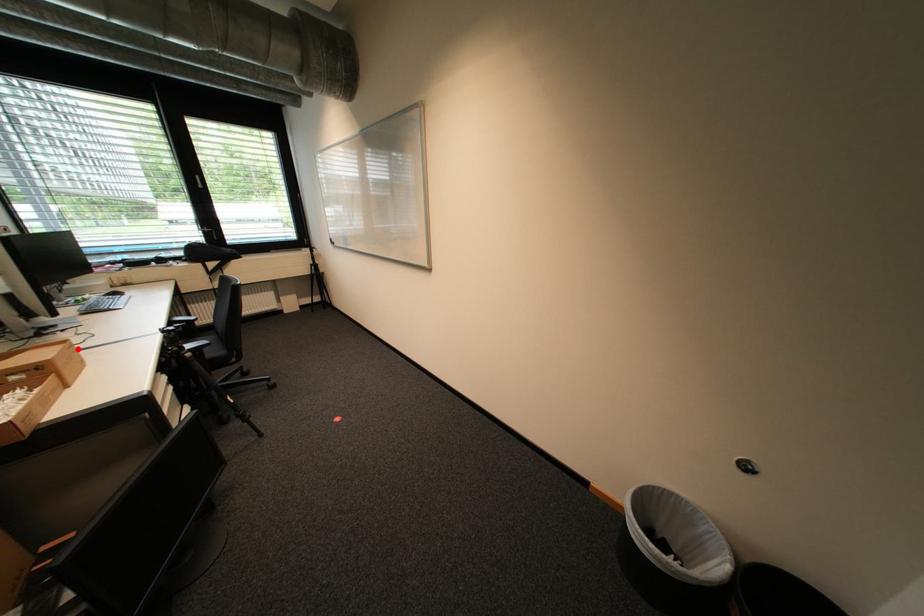
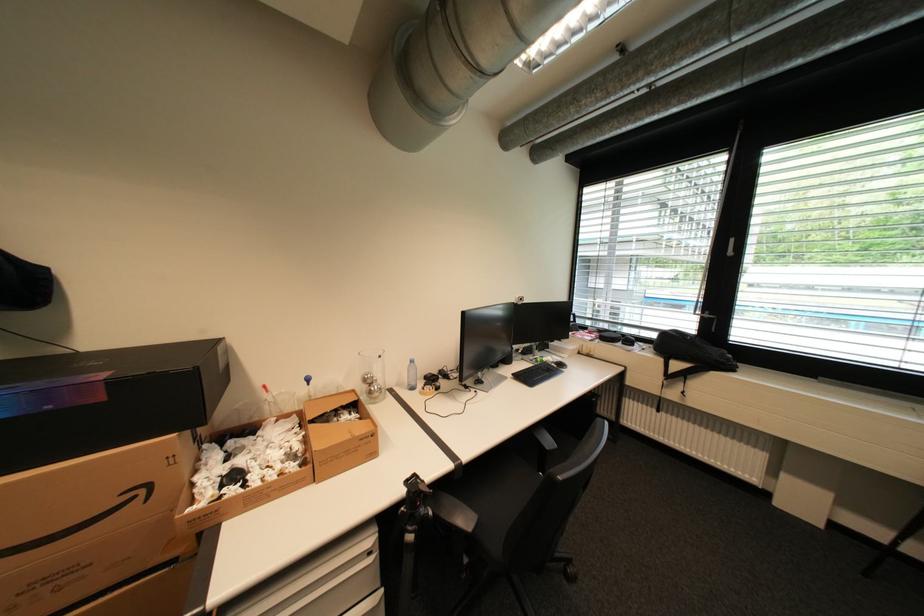
Question: I am providing you with two images of the same scene from different viewpoints. A red point is marked on the first image. Can you still see the location of the red point in image 2?

Choices:
 (A) Yes
 (B) No

Answer: (A)